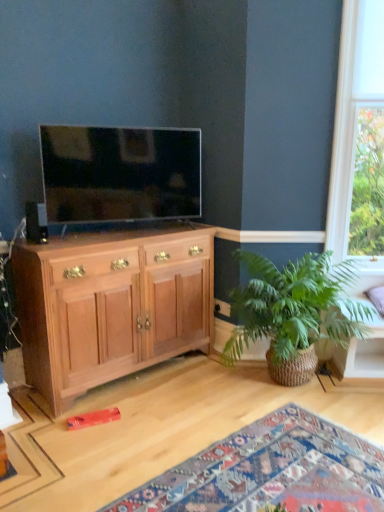
Where is `free region under matte black tv at upper left (from a real-world perspective)`? free region under matte black tv at upper left (from a real-world perspective) is located at coordinates (115, 232).